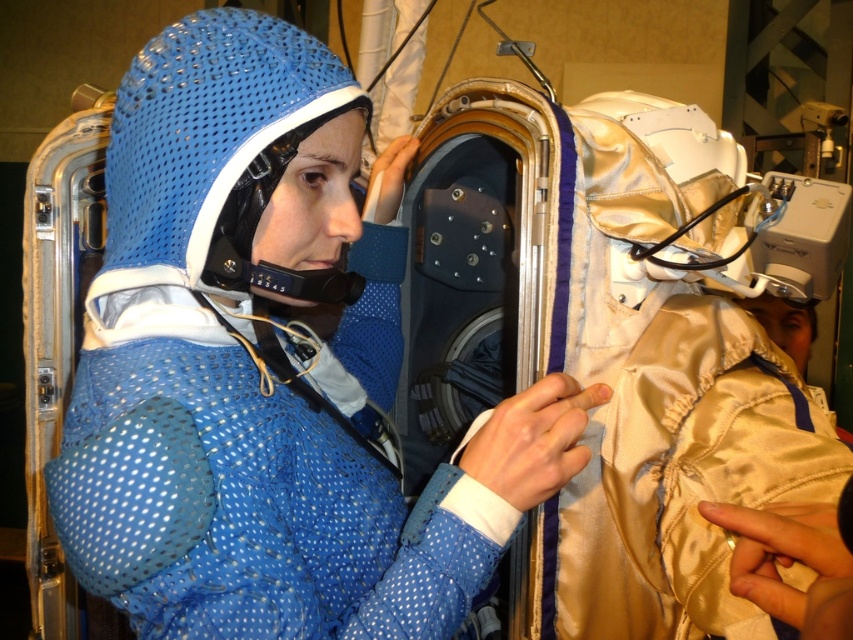
Question: Considering the relative positions of blue mesh suit at center and blue mesh helmet at center in the image provided, where is blue mesh suit at center located with respect to blue mesh helmet at center?

Choices:
 (A) above
 (B) below

Answer: (B)

Question: Which of the following is the closest to the observer?

Choices:
 (A) (157, 99)
 (B) (248, 554)

Answer: (B)

Question: Is blue mesh suit at center positioned at the back of blue mesh helmet at center?

Choices:
 (A) no
 (B) yes

Answer: (A)

Question: Is blue mesh suit at center closer to the viewer compared to blue mesh helmet at center?

Choices:
 (A) no
 (B) yes

Answer: (B)